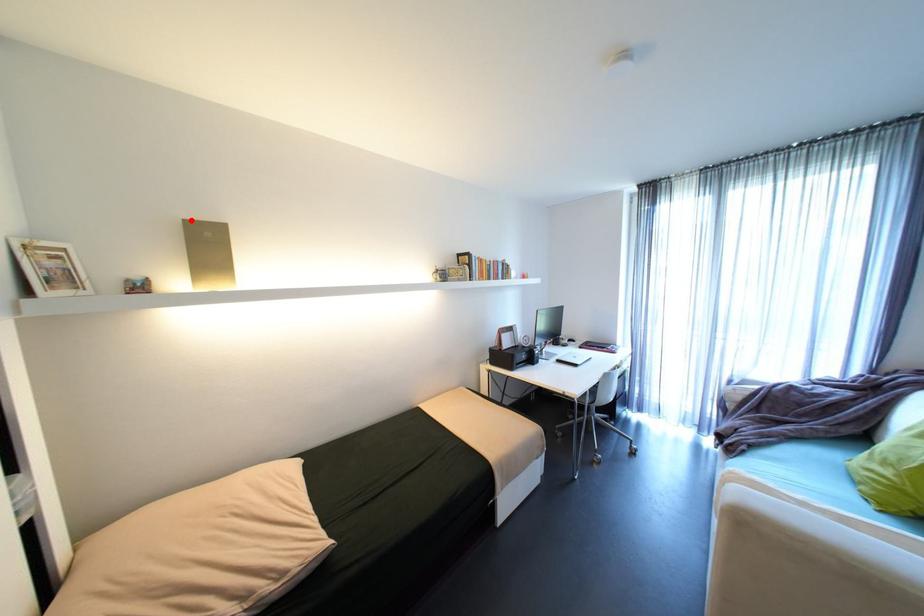
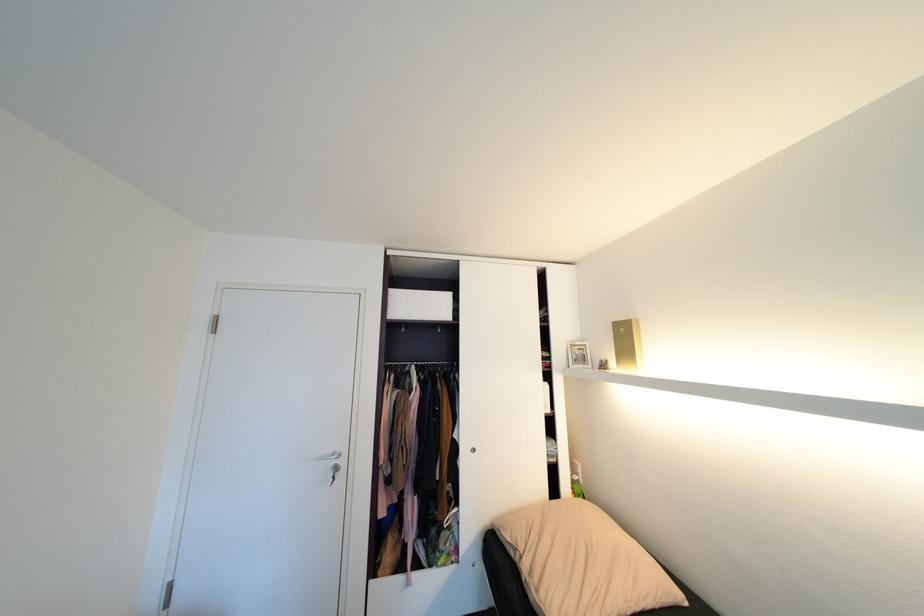
Find the pixel in the second image that matches the highlighted location in the first image.

(621, 323)